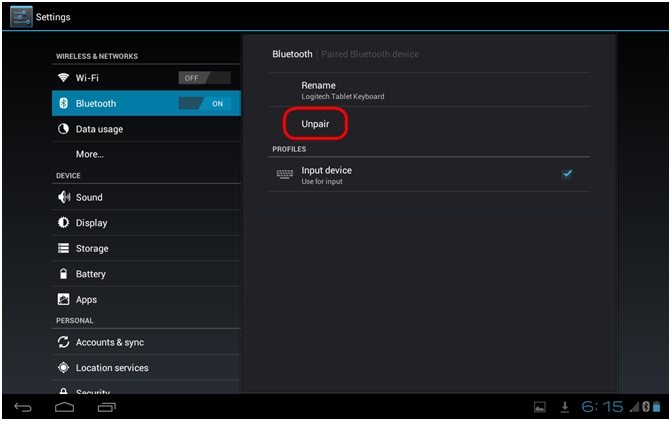
Identify the location of on toggle switch. (217, 103).